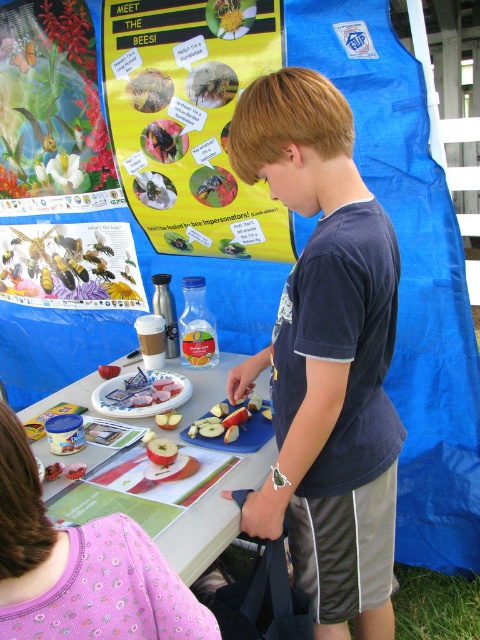
Question: In this image, where is white plastic table at center located relative to sliced red apple at lower center?

Choices:
 (A) left
 (B) right

Answer: (B)

Question: Which is nearer to the matte yellow poster at upper center?

Choices:
 (A) sliced matte apple at center
 (B) sliced apple at center
 (C) metallic poster at upper left

Answer: (C)

Question: Which is nearer to the dark blue t-shirt at center?

Choices:
 (A) sliced red apple at lower center
 (B) sliced apple at center

Answer: (A)

Question: Which object is the closest to the sliced matte apple at center?

Choices:
 (A) matte yellow poster at upper center
 (B) dark blue t-shirt at center
 (C) sliced red apple at lower center
 (D) red matte apple at center

Answer: (D)

Question: Is smooth red apple at center in front of sliced apple at center?

Choices:
 (A) no
 (B) yes

Answer: (B)

Question: Does sliced matte apple at center have a greater width compared to sliced red apple at lower center?

Choices:
 (A) no
 (B) yes

Answer: (B)